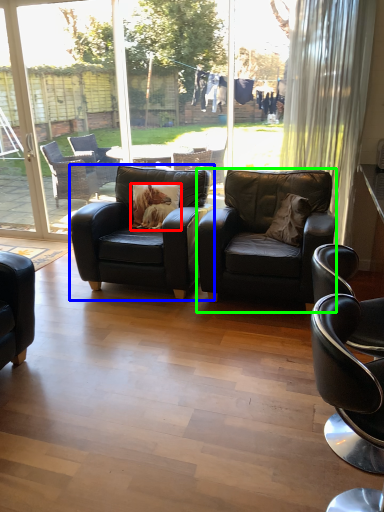
Question: Estimate the real-world distances between objects in this image. Which object is farther from pillow (highlighted by a red box), chair (highlighted by a blue box) or chair (highlighted by a green box)?

Choices:
 (A) chair
 (B) chair

Answer: (B)